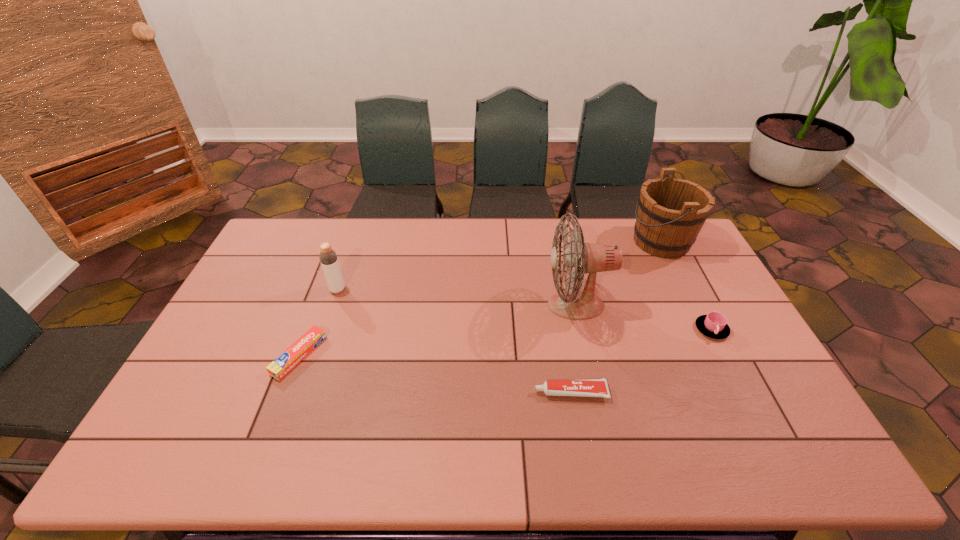
Locate an element on the screen. This screenshot has height=540, width=960. the tallest object is located at coordinates (574, 304).

The width and height of the screenshot is (960, 540). What are the coordinates of `the fifth shortest object` in the screenshot? It's located at (671, 212).

Where is `wine bucket`? This screenshot has height=540, width=960. wine bucket is located at coordinates (671, 212).

In order to click on bottle in this screenshot , I will do `click(328, 257)`.

Where is `the fourth tallest object`? The width and height of the screenshot is (960, 540). the fourth tallest object is located at coordinates (714, 325).

I want to click on the right toothpaste, so (x=589, y=387).

At what (x,y) coordinates should I click in order to perform the action: click on the taller toothpaste. Please return your answer as a coordinate pair (x, y). The width and height of the screenshot is (960, 540). Looking at the image, I should click on (589, 387).

Where is `the shorter toothpaste`? the shorter toothpaste is located at coordinates (283, 364).

Where is `the farther toothpaste`? Image resolution: width=960 pixels, height=540 pixels. the farther toothpaste is located at coordinates (283, 364).

Locate an element on the screen. Image resolution: width=960 pixels, height=540 pixels. free space located 0.270m in front of the fan to direct airflow is located at coordinates (460, 305).